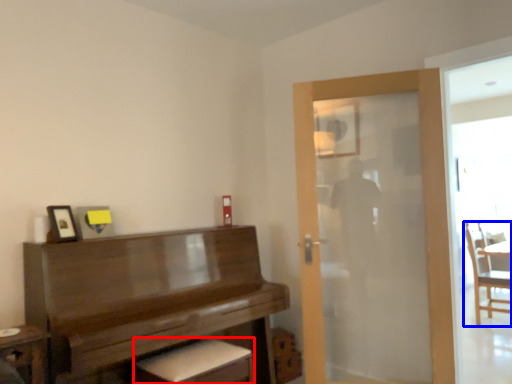
Question: Which object is closer to the camera taking this photo, footrest (highlighted by a red box) or chair (highlighted by a blue box)?

Choices:
 (A) footrest
 (B) chair

Answer: (A)